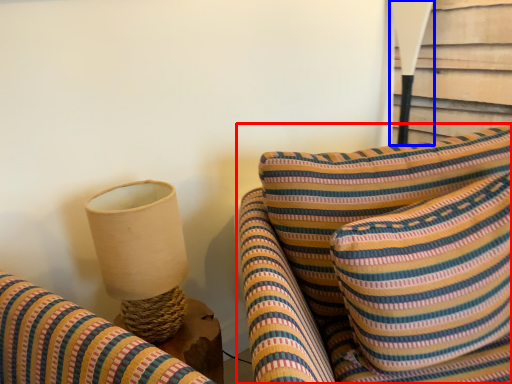
Question: Among these objects, which one is farthest to the camera, furniture (highlighted by a red box) or table lamp (highlighted by a blue box)?

Choices:
 (A) furniture
 (B) table lamp

Answer: (B)